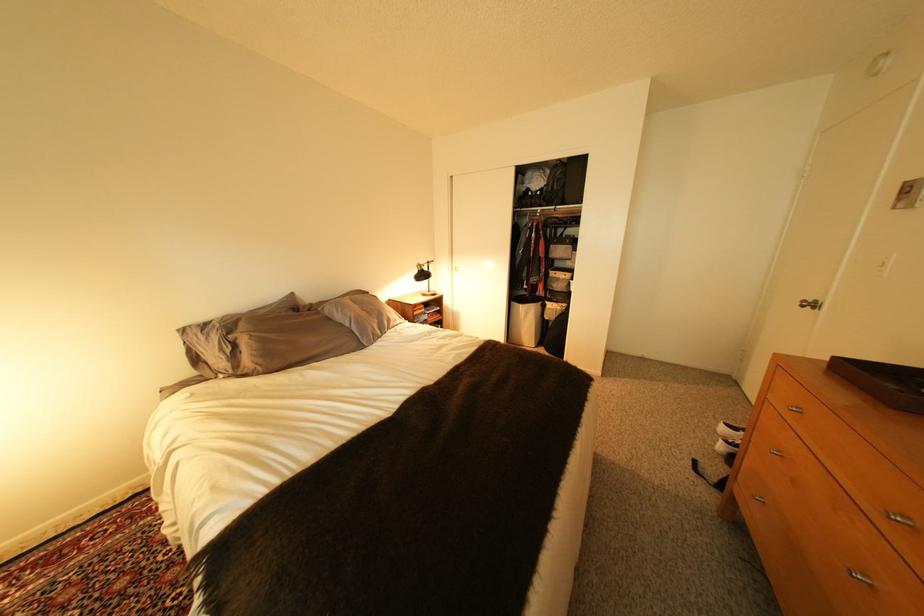
The location [554,185] corresponds to which object?

It refers to a black backpack.